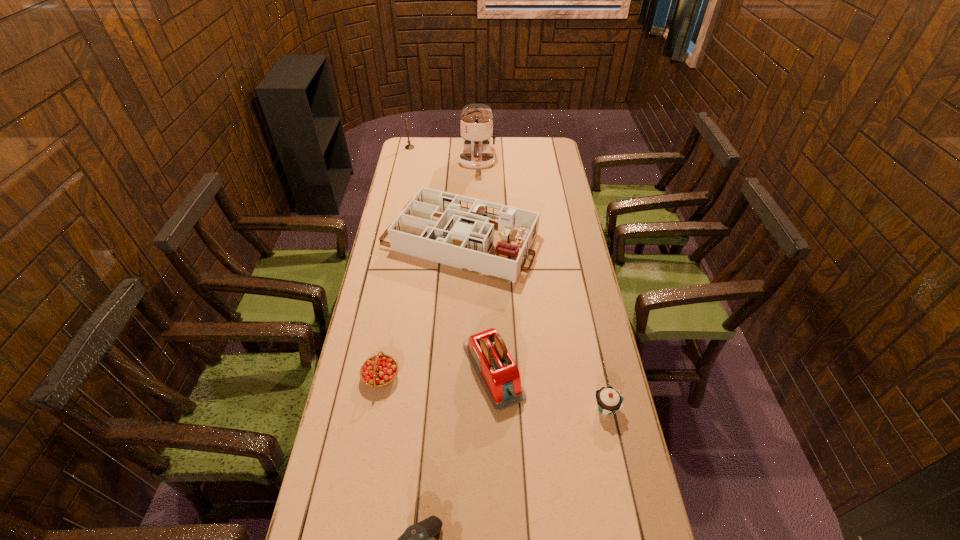
Identify the location of vacant space situated 0.400m on the back of the third farthest object. The height and width of the screenshot is (540, 960). [464, 156].

The image size is (960, 540). I want to click on free point located on the front of the strawberry, so click(x=366, y=463).

Identify the location of free region located 0.280m on the left of the rightmost object. The width and height of the screenshot is (960, 540). pyautogui.click(x=492, y=408).

The width and height of the screenshot is (960, 540). Identify the location of coffee maker that is at the far edge. (476, 121).

What are the coordinates of `candle that is positioned at the far edge` in the screenshot? It's located at (409, 146).

Locate an element on the screen. Image resolution: width=960 pixels, height=540 pixels. candle positioned at the left edge is located at coordinates (409, 146).

I want to click on dollhouse that is positioned at the left edge, so click(x=455, y=230).

You are a GUI agent. You are given a task and a screenshot of the screen. Output one action in this format:
    pyautogui.click(x=<x>, y=<y>)
    Task: Click on the strawberry present at the left edge
    This screenshot has height=540, width=960.
    Given the screenshot: What is the action you would take?
    [x=378, y=371]

You are a GUI agent. You are given a task and a screenshot of the screen. Output one action in this format:
    pyautogui.click(x=<x>, y=<y>)
    Task: Click on the dollhouse present at the right edge
    Image resolution: width=960 pixels, height=540 pixels.
    Given the screenshot: What is the action you would take?
    pos(455,230)

Where is `cupcake located in the right edge section of the desktop`? cupcake located in the right edge section of the desktop is located at coordinates (608, 400).